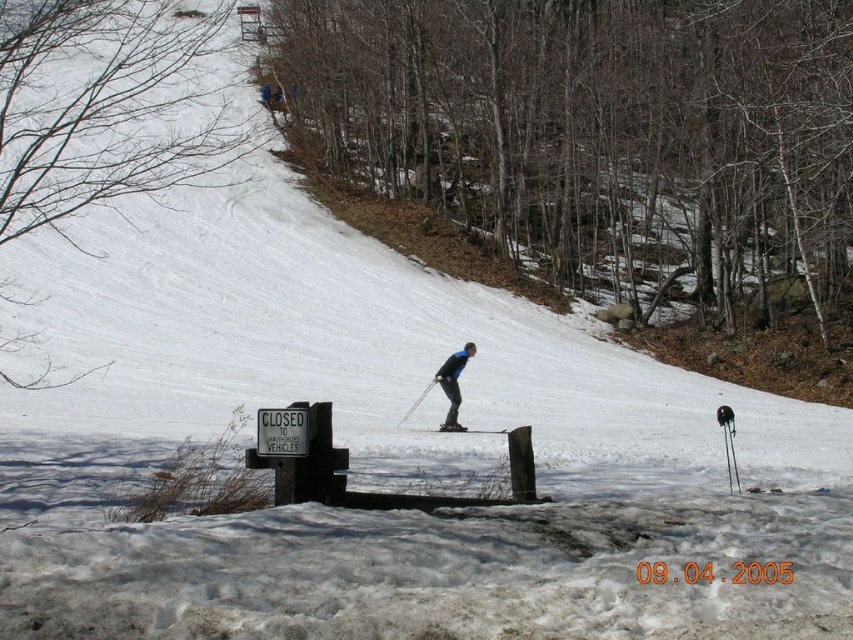
Question: Does blue matte skier at center appear under black matte ski at center?

Choices:
 (A) no
 (B) yes

Answer: (A)

Question: Is blue matte skier at center above black matte ski at center?

Choices:
 (A) yes
 (B) no

Answer: (A)

Question: Is blue fabric snowsuit at center positioned before blue matte skier at center?

Choices:
 (A) yes
 (B) no

Answer: (A)

Question: Which point is closer to the camera?

Choices:
 (A) (471, 353)
 (B) (405, 417)
 (C) (453, 426)

Answer: (C)

Question: Based on their relative distances, which object is nearer to the blue fabric snowsuit at center?

Choices:
 (A) blue matte skier at center
 (B) black matte ski at center

Answer: (A)

Question: Which point is farther to the camera?

Choices:
 (A) blue fabric snowsuit at center
 (B) black matte ski at center

Answer: (A)